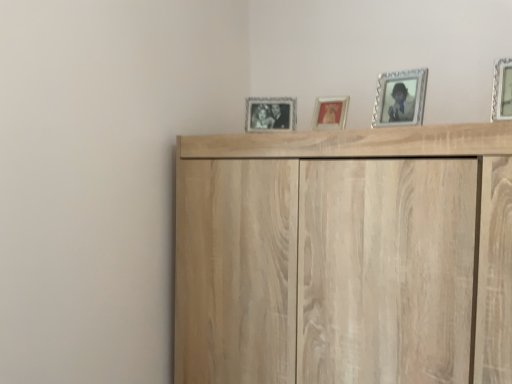
Question: Does light wood cupboard at upper center have a larger size compared to silver textured picture frame at upper right, which is counted as the 3th picture frame, starting from the back?

Choices:
 (A) yes
 (B) no

Answer: (A)

Question: Is light wood cupboard at upper center beside silver textured picture frame at upper right, acting as the second picture frame starting from the front?

Choices:
 (A) yes
 (B) no

Answer: (B)

Question: Can you confirm if light wood cupboard at upper center is positioned to the left of silver textured picture frame at upper right, acting as the second picture frame starting from the front?

Choices:
 (A) yes
 (B) no

Answer: (A)

Question: Is light wood cupboard at upper center closer to the viewer compared to silver textured picture frame at upper right, which is counted as the 3th picture frame, starting from the back?

Choices:
 (A) yes
 (B) no

Answer: (A)

Question: Would you say light wood cupboard at upper center contains silver textured picture frame at upper right, which is the second picture frame in right-to-left order?

Choices:
 (A) yes
 (B) no

Answer: (B)

Question: Considering the positions of silver textured picture frame at upper right, marked as the third picture frame in a left-to-right arrangement, and light wood cupboard at upper center in the image, is silver textured picture frame at upper right, marked as the third picture frame in a left-to-right arrangement, taller or shorter than light wood cupboard at upper center?

Choices:
 (A) tall
 (B) short

Answer: (B)

Question: From a real-world perspective, relative to light wood cupboard at upper center, is silver textured picture frame at upper right, which is counted as the 3th picture frame, starting from the back, vertically above or below?

Choices:
 (A) above
 (B) below

Answer: (A)

Question: From the image's perspective, is silver textured picture frame at upper right, which is counted as the 3th picture frame, starting from the back, located above or below light wood cupboard at upper center?

Choices:
 (A) above
 (B) below

Answer: (A)

Question: Considering the positions of point (397, 122) and point (387, 332), is point (397, 122) closer or farther from the camera than point (387, 332)?

Choices:
 (A) closer
 (B) farther

Answer: (B)

Question: Would you say metallic silver picture frame at center, the 3th picture frame from the front, is to the left or to the right of silver metallic picture frame at upper right, which is counted as the 1th picture frame, starting from the front, in the picture?

Choices:
 (A) right
 (B) left

Answer: (B)

Question: Looking at their shapes, would you say metallic silver picture frame at center, which is the 2th picture frame from left to right, is wider or thinner than silver metallic picture frame at upper right, which is counted as the 1th picture frame, starting from the front?

Choices:
 (A) thin
 (B) wide

Answer: (A)

Question: Is point (338, 105) positioned closer to the camera than point (505, 119)?

Choices:
 (A) closer
 (B) farther

Answer: (B)

Question: From their relative heights in the image, would you say metallic silver picture frame at center, which is the 2th picture frame from left to right, is taller or shorter than silver metallic picture frame at upper right, which ranks as the first picture frame in right-to-left order?

Choices:
 (A) tall
 (B) short

Answer: (B)

Question: Considering the positions of silver textured picture frame at upper right, marked as the third picture frame in a left-to-right arrangement, and metallic silver picture frame at center, the 2th picture frame positioned from the back, in the image, is silver textured picture frame at upper right, marked as the third picture frame in a left-to-right arrangement, taller or shorter than metallic silver picture frame at center, the 2th picture frame positioned from the back,?

Choices:
 (A) short
 (B) tall

Answer: (B)

Question: From the image's perspective, is silver textured picture frame at upper right, which is the second picture frame in right-to-left order, positioned above or below metallic silver picture frame at center, the 3th picture frame from the front?

Choices:
 (A) above
 (B) below

Answer: (A)